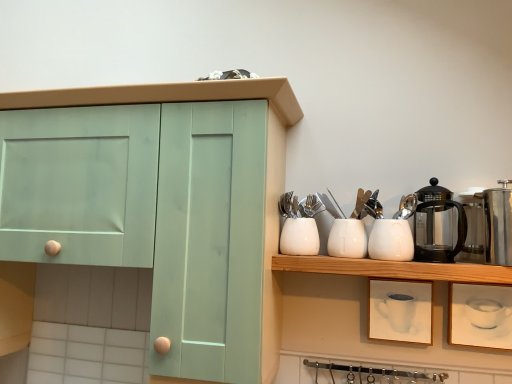
Question: Is point (342, 226) closer or farther from the camera than point (455, 206)?

Choices:
 (A) farther
 (B) closer

Answer: (B)

Question: From a real-world perspective, is white glossy container at center, the 2th tableware in the left-to-right sequence, positioned above or below black glass coffee pot at upper right?

Choices:
 (A) below
 (B) above

Answer: (A)

Question: Estimate the real-world distances between objects in this image. Which object is farther from the white glossy kettle at upper right, the third appliance when ordered from right to left?

Choices:
 (A) white glossy container at center, the 2th tableware in the left-to-right sequence
 (B) white glossy vase at center, which ranks as the third tableware in right-to-left order
 (C) black glass coffee pot at upper right
 (D) silver metallic forks at upper center
 (E) polished stainless steel coffee pot at right, which ranks as the third appliance in left-to-right order

Answer: (D)

Question: Based on their relative distances, which object is farther from the clear glass carafe at upper right, placed as the second appliance when sorted from left to right?

Choices:
 (A) black glass coffee pot at upper right
 (B) metallic silver french press at right, which appears as the 1th tableware when viewed from the right
 (C) silver metallic forks at upper center
 (D) white glossy kettle at upper right, which is the 1th appliance in left-to-right order
 (E) white glossy container at center, marked as the 2th tableware in a right-to-left arrangement

Answer: (C)